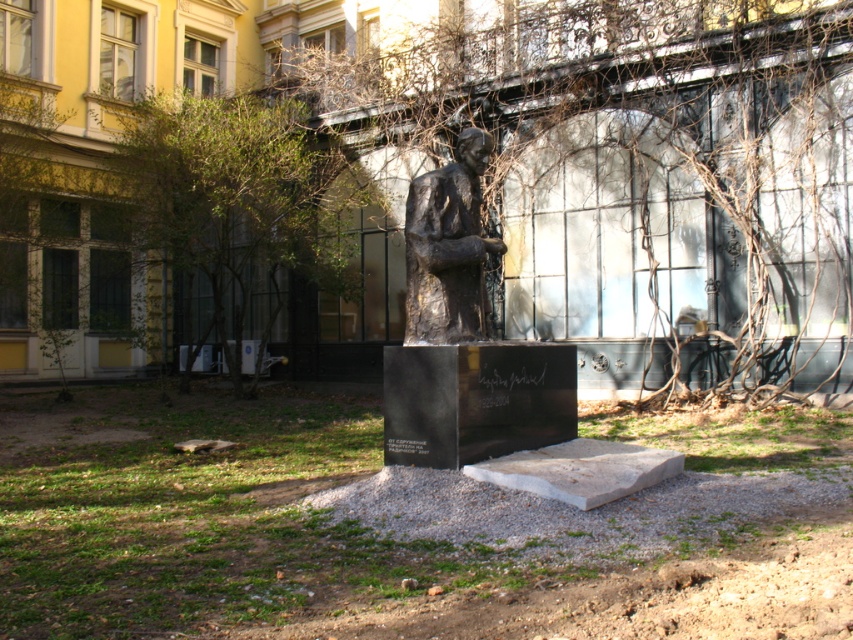
Between point (608, 196) and point (440, 320), which one is positioned behind?

Point (608, 196)

Is point (567, 332) more distant than point (447, 170)?

Yes, point (567, 332) is behind point (447, 170).

Who is more forward, (651, 292) or (463, 136)?

Point (463, 136) is in front.

This screenshot has height=640, width=853. Identify the location of brown leafless branches at center. (625, 179).

From the picture: Is brown leafless branches at center above green leafy tree at upper left?

Indeed, brown leafless branches at center is positioned over green leafy tree at upper left.

Is point (354, 76) behind point (258, 173)?

Yes.

Locate an element on the screen. This screenshot has height=640, width=853. brown leafless branches at center is located at coordinates (625, 179).

Between green leafy tree at upper left and bronze statue at center, which one has more height?

With more height is bronze statue at center.

Does green leafy tree at upper left come in front of bronze statue at center?

No, green leafy tree at upper left is behind bronze statue at center.

Does point (204, 116) lie in front of point (416, 291)?

No, (204, 116) is behind (416, 291).

Image resolution: width=853 pixels, height=640 pixels. I want to click on green leafy tree at upper left, so click(241, 205).